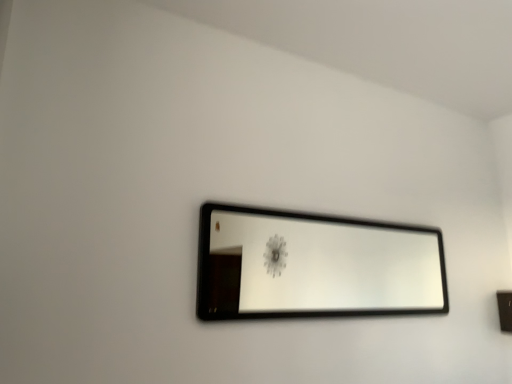
The image size is (512, 384). Describe the element at coordinates (328, 264) in the screenshot. I see `black glossy mirror at center` at that location.

What is the approximate width of black glossy mirror at center?

2.55 inches.

Find the location of a particular element. This screenshot has width=512, height=384. black glossy mirror at center is located at coordinates (328, 264).

Image resolution: width=512 pixels, height=384 pixels. Identify the location of black glossy mirror at center. (328, 264).